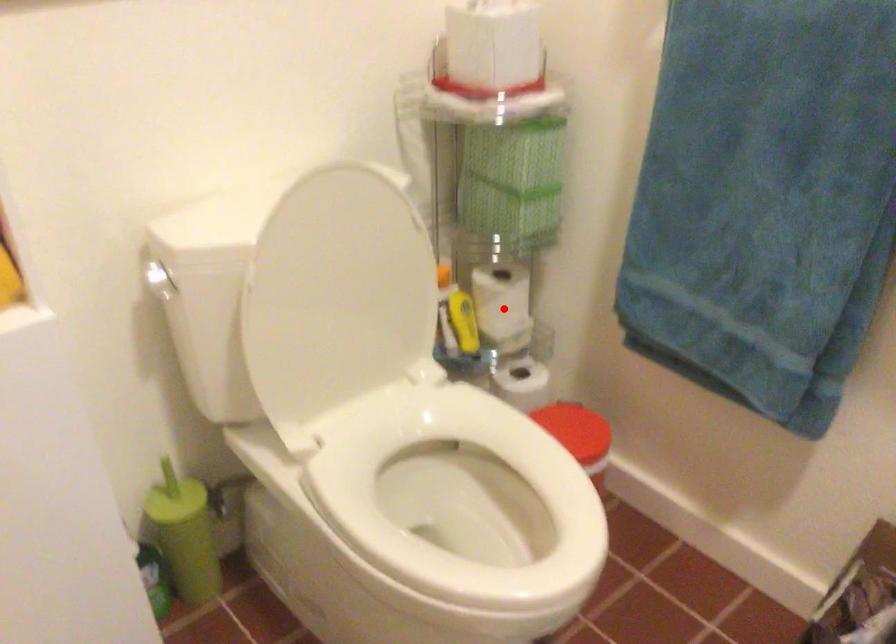
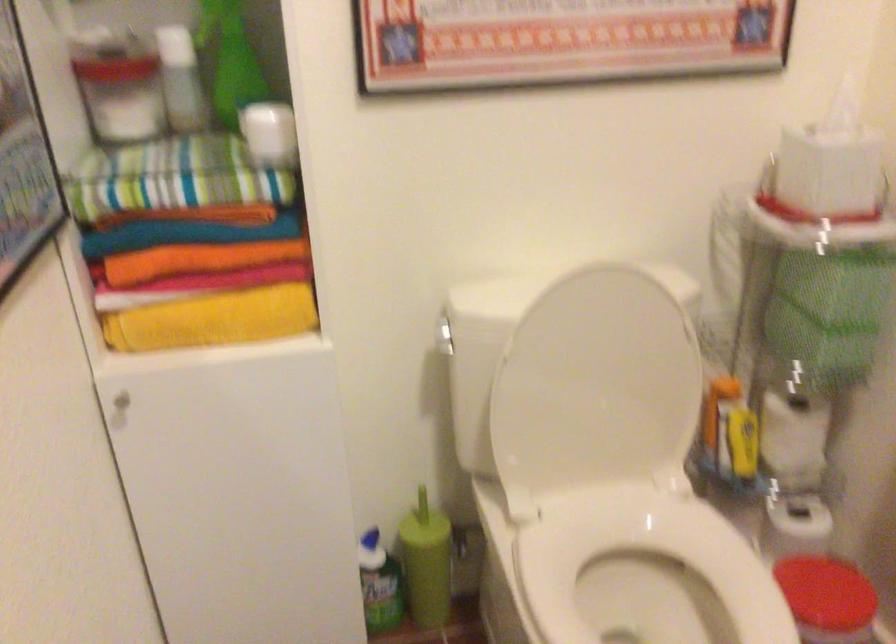
In the second image, find the point that corresponds to the highlighted location in the first image.

(793, 440)